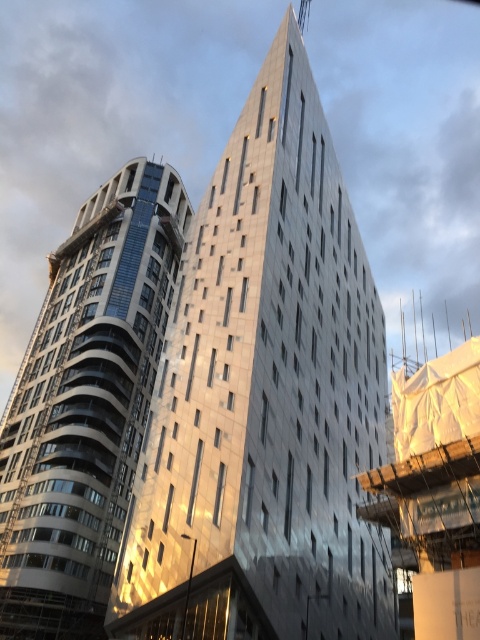
Does metallic silver building at center have a larger size compared to metallic glass tower at left?

Correct, metallic silver building at center is larger in size than metallic glass tower at left.

Which is in front, point (199, 273) or point (0, 520)?

Positioned in front is point (199, 273).

Who is more distant from viewer, (260, 280) or (83, 289)?

Point (83, 289)

Find the location of a particular element. Image resolution: width=480 pixels, height=640 pixels. metallic silver building at center is located at coordinates (264, 397).